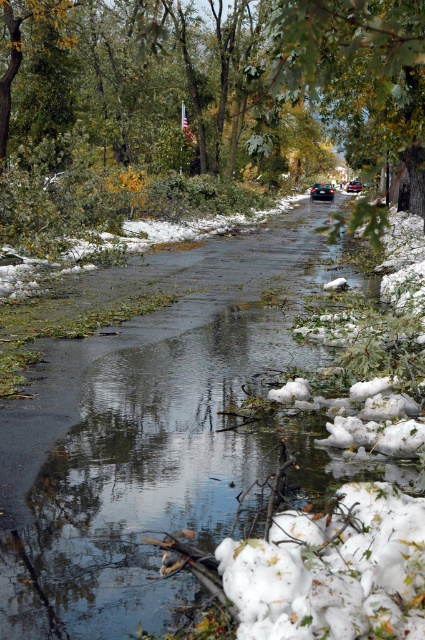
You are a pedestrian standing at the edge of the road and want to cross to the other side. There are two cars in the middle of the road, a black matte car at center and a metallic red car at center. Which car is closer to you?

The black matte car at center is closer to the viewer than the metallic red car at center, so the black matte car at center is the one closer to you.

From the picture: You are standing at the point marked by the coordinates [322,192] in the image. What object is exactly at this location?

The black matte car at center is located at point [322,192].

You are standing at the camera position and want to cross the road to reach the black matte car at center. The road is flooded with 30 cm of water. Your wheelchair has a 25 cm water wading capability. Is the wheelchair able to safely reach the car?

The black matte car at center is 64.59 meters away from the camera. Since the wheelchair can only wade through 25 cm of water and the road has 30 cm of water, the wheelchair cannot safely reach the car due to the water depth exceeding its capability.